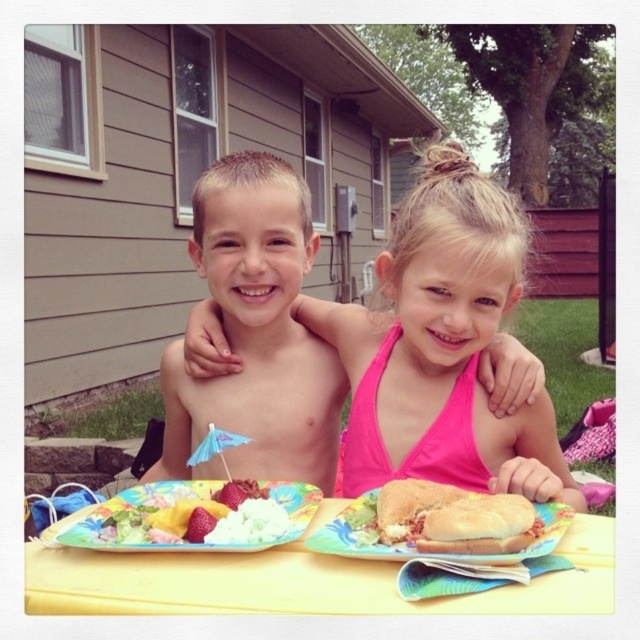
Question: Is shiny blonde hair at upper center further to camera compared to slightly toasted bread at center?

Choices:
 (A) yes
 (B) no

Answer: (A)

Question: Is yellow plastic table at center smaller than slightly toasted bread at center?

Choices:
 (A) no
 (B) yes

Answer: (A)

Question: In this image, where is matte plastic platter at lower left located relative to strawberrysmoothfruit at center?

Choices:
 (A) right
 (B) left

Answer: (B)

Question: Estimate the real-world distances between objects in this image. Which object is farther from the matte plastic platter at lower left?

Choices:
 (A) strawberrysmoothfruit at center
 (B) shiny blonde hair at upper center

Answer: (B)

Question: Estimate the real-world distances between objects in this image. Which object is closer to the shiny blonde hair at upper center?

Choices:
 (A) slightly toasted bread at center
 (B) yellow plastic table at center
 (C) matte plastic platter at lower left

Answer: (A)

Question: Based on their relative distances, which object is nearer to the strawberry at center?

Choices:
 (A) matte paper plate at center
 (B) strawberrysmoothfruit at center
 (C) matte plastic platter at lower left

Answer: (B)